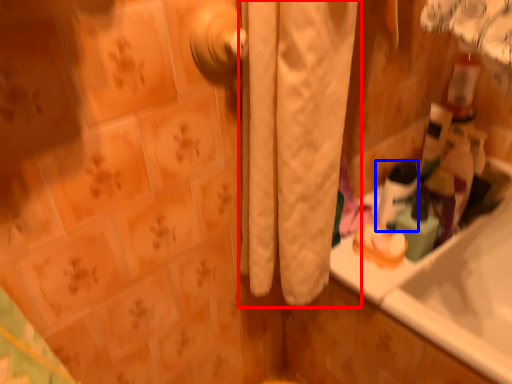
Question: Which object appears farthest to the camera in this image, curtain (highlighted by a red box) or mouthwash (highlighted by a blue box)?

Choices:
 (A) curtain
 (B) mouthwash

Answer: (B)